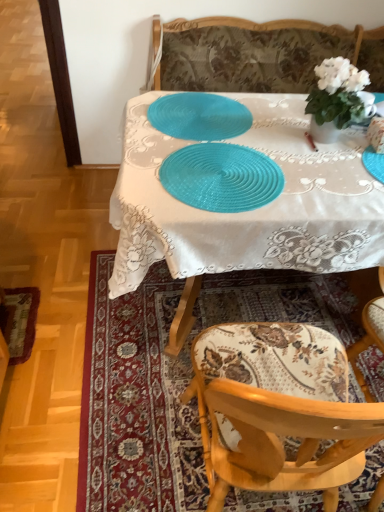
Locate an element on the screen. This screenshot has width=384, height=512. vacant area that is situated to the right of teal woven placemat at center, arranged as the first tableware when viewed from the front is located at coordinates (322, 179).